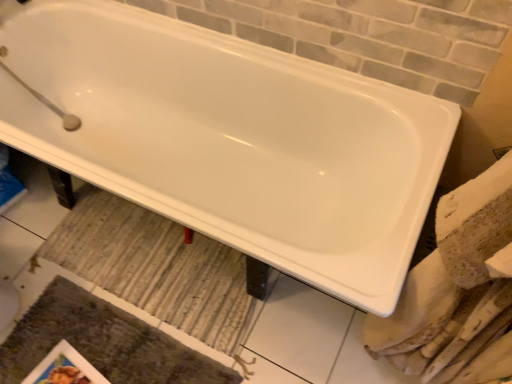
I want to click on empty space that is to the right of matte paper magazine at lower left, so click(140, 358).